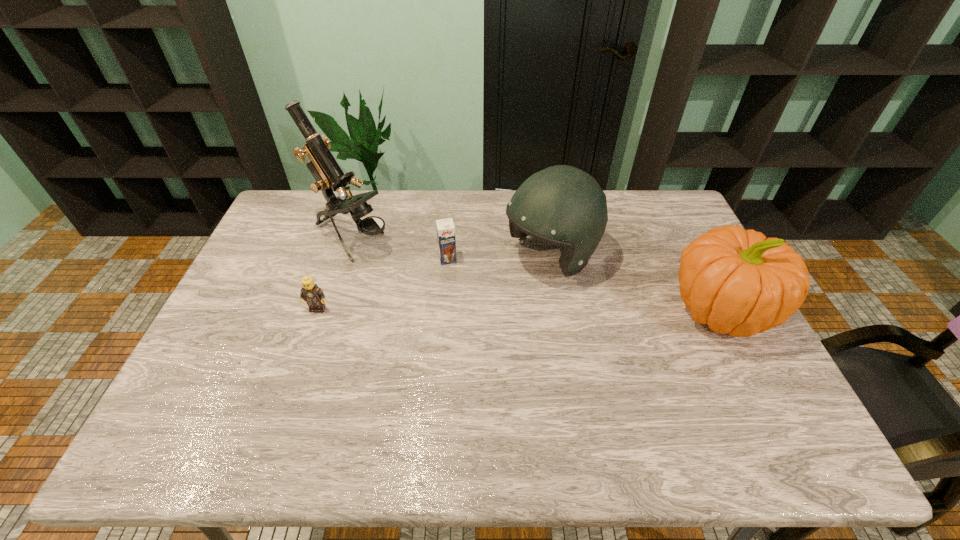
The image size is (960, 540). What are the coordinates of `free space between the fourth tallest object and the tallest object` in the screenshot? It's located at (399, 249).

Find the location of a particular element. The height and width of the screenshot is (540, 960). empty location between the shortest object and the microscope is located at coordinates (335, 274).

Where is `empty space between the third object from right to left and the rightmost object`? This screenshot has width=960, height=540. empty space between the third object from right to left and the rightmost object is located at coordinates (586, 284).

This screenshot has height=540, width=960. Identify the location of free spot between the microscope and the shortest object. (335, 274).

At what (x,y) coordinates should I click in order to perform the action: click on the closest object to the fourth object from left to right. Please return your answer as a coordinate pair (x, y). Looking at the image, I should click on (445, 227).

Select which object appears as the closest to the tallest object. Please provide its 2D coordinates. Your answer should be formatted as a tuple, i.e. [(x, y)], where the tuple contains the x and y coordinates of a point satisfying the conditions above.

[(445, 227)]

Locate an element on the screen. Image resolution: width=960 pixels, height=540 pixels. vacant space that satisfies the following two spatial constraints: 1. on the front side of the pumpkin; 2. on the surface of the microscope is located at coordinates (329, 308).

This screenshot has height=540, width=960. Find the location of `vacant space that satisfies the following two spatial constraints: 1. on the front side of the football helmet; 2. on the surface of the rightmost object`. vacant space that satisfies the following two spatial constraints: 1. on the front side of the football helmet; 2. on the surface of the rightmost object is located at coordinates (560, 308).

Identify the location of vacant region that satisfies the following two spatial constraints: 1. on the front side of the rightmost object; 2. on the surface of the tallest object. The width and height of the screenshot is (960, 540). (329, 308).

At what (x,y) coordinates should I click in order to perform the action: click on vacant region that satisfies the following two spatial constraints: 1. on the front side of the pumpkin; 2. on the surface of the second shortest object. Please return your answer as a coordinate pair (x, y). The image size is (960, 540). Looking at the image, I should click on (444, 308).